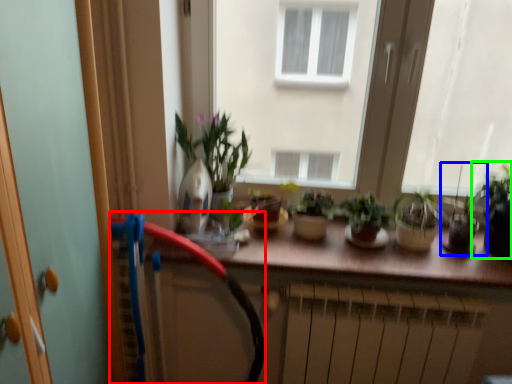
Question: Based on their relative distances, which object is nearer to garden hose (highlighted by a red box)? Choose from houseplant (highlighted by a blue box) and houseplant (highlighted by a green box).

Choices:
 (A) houseplant
 (B) houseplant

Answer: (A)